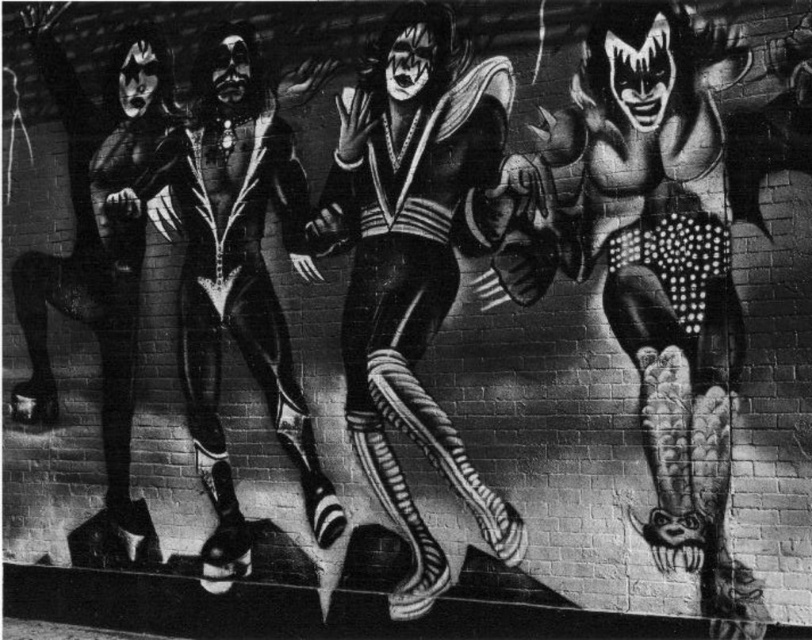
Question: Is black leather suit at center thinner than shiny black leather suit at center?

Choices:
 (A) yes
 (B) no

Answer: (A)

Question: Is black leather suit at center closer to camera compared to shiny black leather suit at center?

Choices:
 (A) no
 (B) yes

Answer: (B)

Question: Observing the image, what is the correct spatial positioning of shiny black costume at center in reference to black leather suit at center?

Choices:
 (A) above
 (B) below

Answer: (B)

Question: Which point is farther to the camera?

Choices:
 (A) coord(379,445)
 (B) coord(171,147)

Answer: (B)

Question: Among these points, which one is farthest from the camera?

Choices:
 (A) (396, 320)
 (B) (208, 301)

Answer: (B)

Question: Which is nearer to the shiny black leather suit at center?

Choices:
 (A) black leather suit at center
 (B) shiny black costume at center

Answer: (A)